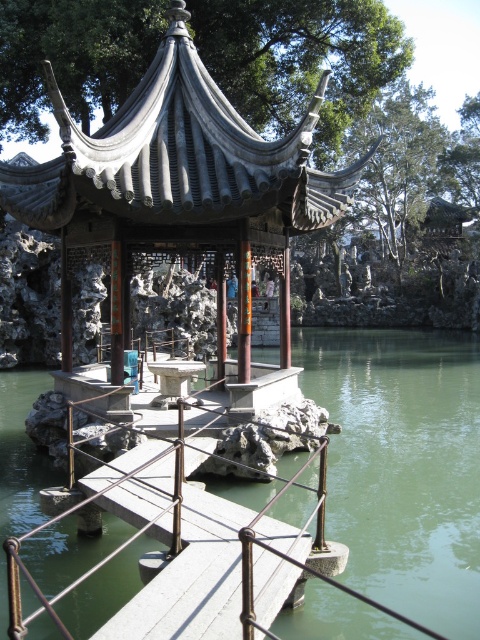
Question: Among these points, which one is farthest from the camera?

Choices:
 (A) (24, 189)
 (B) (166, 515)

Answer: (A)

Question: Is matte gray gazebo at center to the left of metal/rustic bridge at center from the viewer's perspective?

Choices:
 (A) no
 (B) yes

Answer: (B)

Question: Is matte gray gazebo at center smaller than metal/rustic bridge at center?

Choices:
 (A) no
 (B) yes

Answer: (A)

Question: Which object is closer to the camera taking this photo?

Choices:
 (A) matte gray gazebo at center
 (B) metal/rustic bridge at center

Answer: (B)

Question: Is matte gray gazebo at center thinner than metal/rustic bridge at center?

Choices:
 (A) yes
 (B) no

Answer: (B)